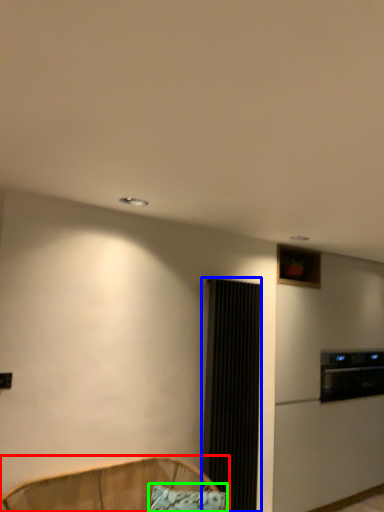
Question: Based on their relative distances, which object is farther from furniture (highlighted by a red box)? Choose from screen door (highlighted by a blue box) and pillow (highlighted by a green box).

Choices:
 (A) screen door
 (B) pillow

Answer: (A)